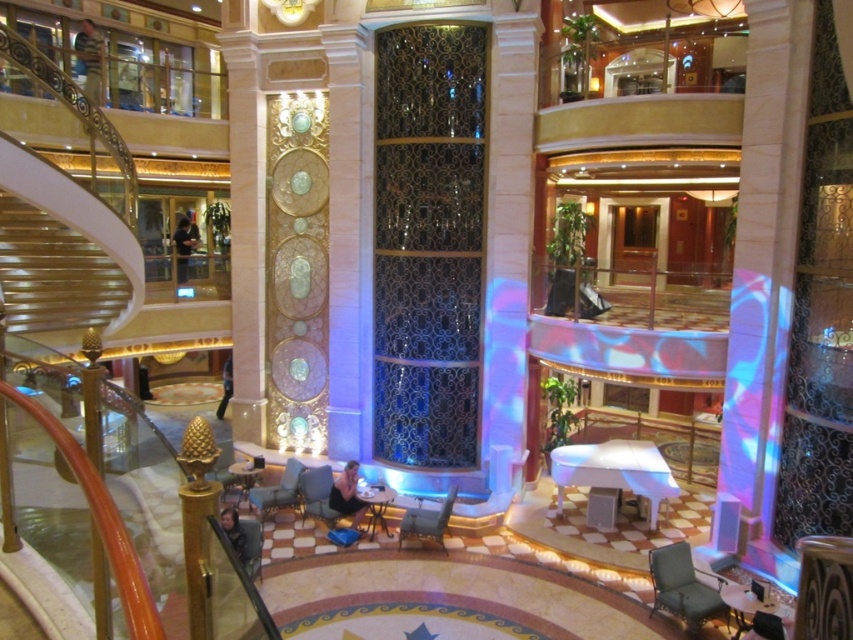
Question: Which of the following is the closest to the observer?

Choices:
 (A) (241, 541)
 (B) (360, 513)
 (C) (223, 397)
 (D) (76, 45)

Answer: (A)

Question: Can you confirm if light brown leather jacket at upper left is thinner than black shirt at center?

Choices:
 (A) yes
 (B) no

Answer: (B)

Question: Can you confirm if light brown leather jacket at upper left is positioned to the left of black shirt at center?

Choices:
 (A) yes
 (B) no

Answer: (A)

Question: Does light brown leather jacket at upper left appear under black shirt at center?

Choices:
 (A) yes
 (B) no

Answer: (B)

Question: Among these points, which one is farthest from the camera?

Choices:
 (A) (234, 528)
 (B) (225, 372)
 (C) (357, 480)

Answer: (B)

Question: Among these objects, which one is farthest from the camera?

Choices:
 (A) dark blue fabric at center
 (B) light brown leather jacket at upper left

Answer: (B)